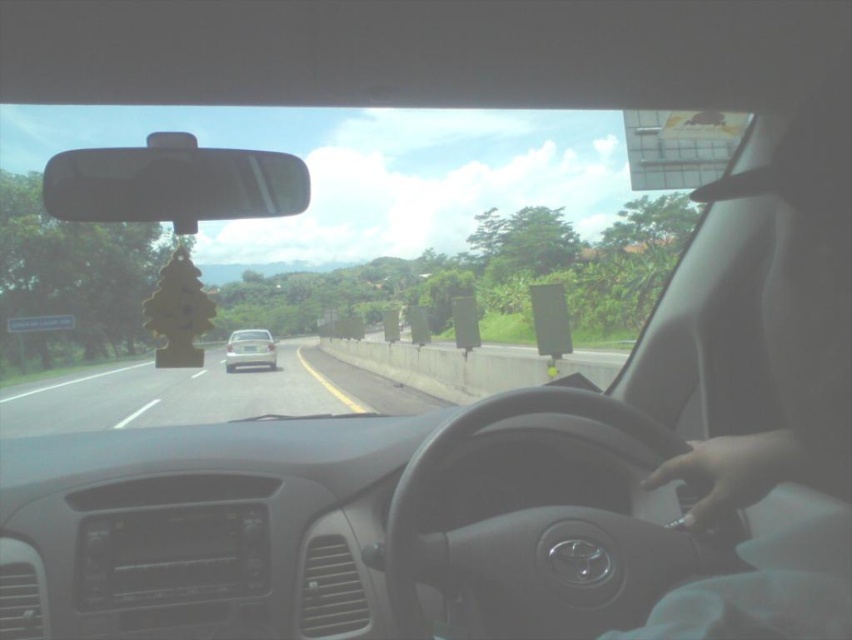
Describe the element at coordinates (360, 252) in the screenshot. I see `transparent glass windshield at center` at that location.

Between point (734, 120) and point (228, 358), which one is positioned in front?

Point (734, 120) is in front.

Is point (396, 320) more distant than point (240, 365)?

No, (396, 320) is closer to viewer.

The width and height of the screenshot is (852, 640). Identify the location of transparent glass windshield at center. (360, 252).

Does black matte view mirror at upper center have a lesser width compared to matte silver sedan at center?

Yes.

Between black matte view mirror at upper center and matte silver sedan at center, which one has more height?

black matte view mirror at upper center is taller.

Find the location of `black matte view mirror at upper center`. black matte view mirror at upper center is located at coordinates (173, 182).

Identify the location of black matte view mirror at upper center. (173, 182).

Which is more to the left, white glossy car at center or matte silver sedan at center?

matte silver sedan at center

Who is lower down, white glossy car at center or matte silver sedan at center?

white glossy car at center

Which is behind, point (106, 368) or point (229, 344)?

The point (106, 368) is more distant.

Where is `white glossy car at center`? This screenshot has height=640, width=852. white glossy car at center is located at coordinates [202, 394].